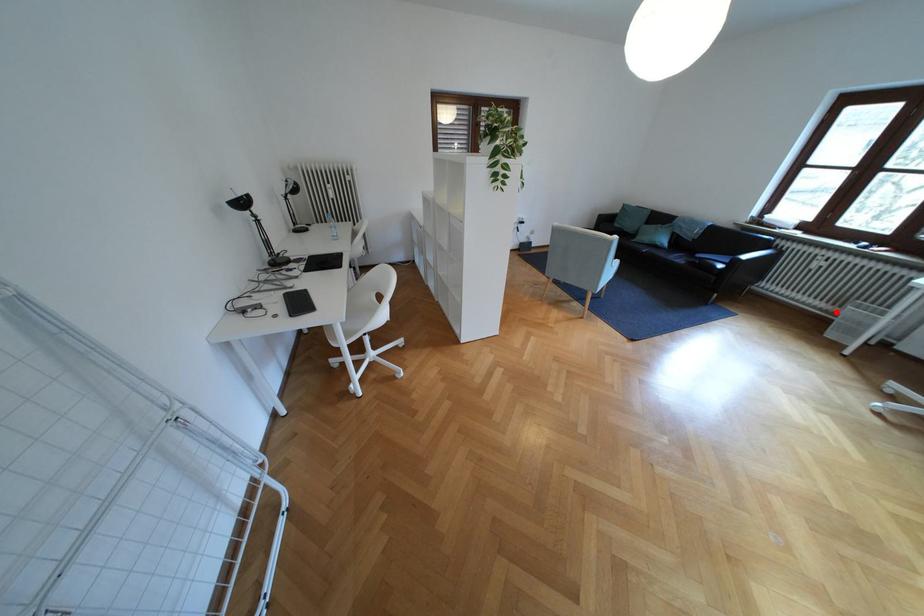
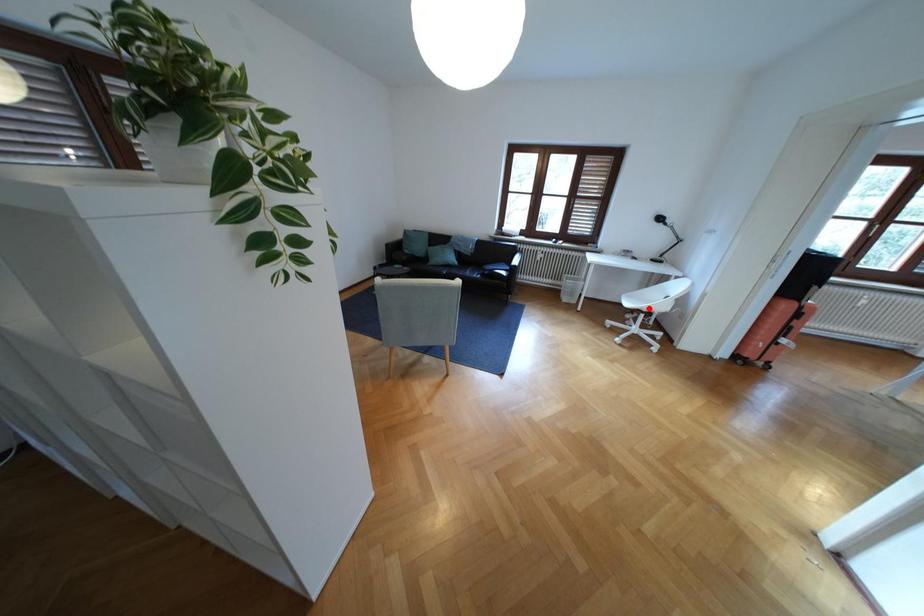
I am providing you with two images of the same scene from different viewpoints. A red point is marked on the first image and another point is marked on the second image. Does the point marked in image1 correspond to the same location as the one in image2?

No